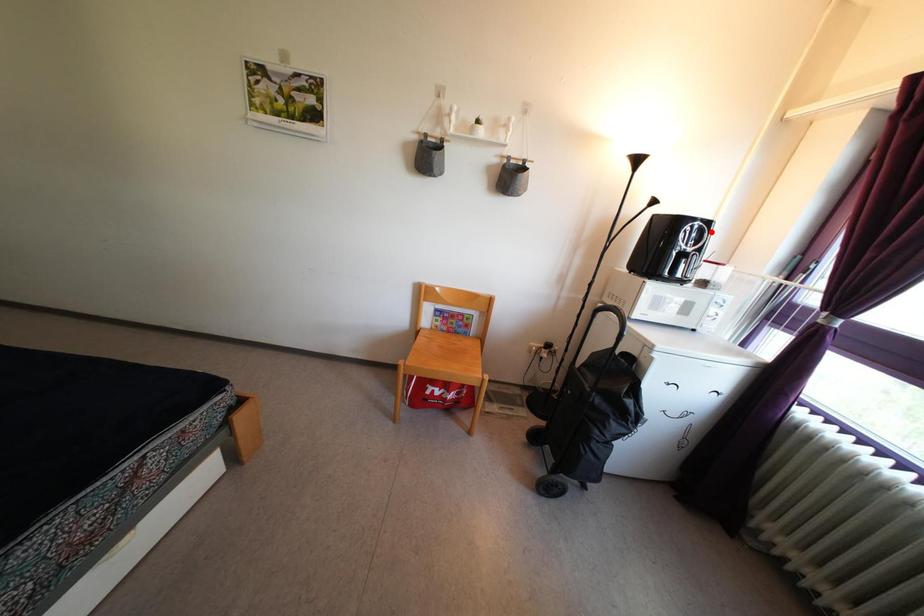
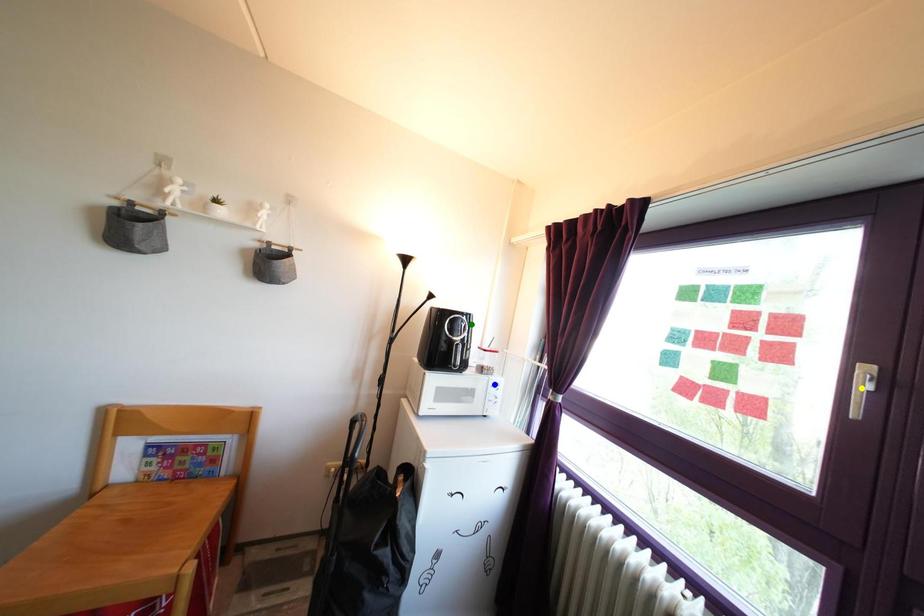
Question: I am providing you with two images of the same scene from different viewpoints. A red point is marked on the first image. You are given multiple points on the second image. In image 2, which mark is for the same physical point as the one in image 1?

Choices:
 (A) blue point
 (B) green point
 (C) yellow point

Answer: (B)